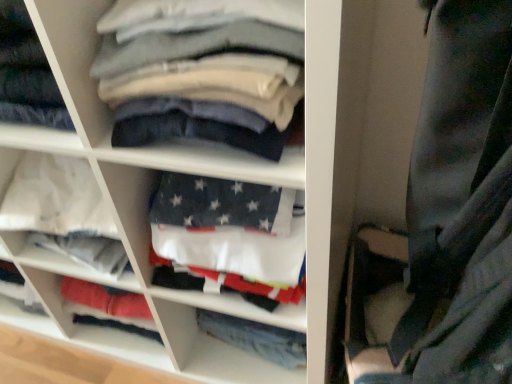
Question: In terms of width, does white fabric at center look wider or thinner when compared to denim pants at center?

Choices:
 (A) wide
 (B) thin

Answer: (A)

Question: Visually, is white fabric at center positioned to the left or to the right of denim pants at center?

Choices:
 (A) right
 (B) left

Answer: (B)

Question: Estimate the real-world distances between objects in this image. Which object is closer to the white cotton shirts at center?

Choices:
 (A) denim pants at center
 (B) smooth cotton shirts at center
 (C) white fabric at center

Answer: (C)

Question: Which object is the closest to the smooth cotton shirts at center?

Choices:
 (A) denim pants at center
 (B) white cotton shirts at center
 (C) white fabric at center

Answer: (B)